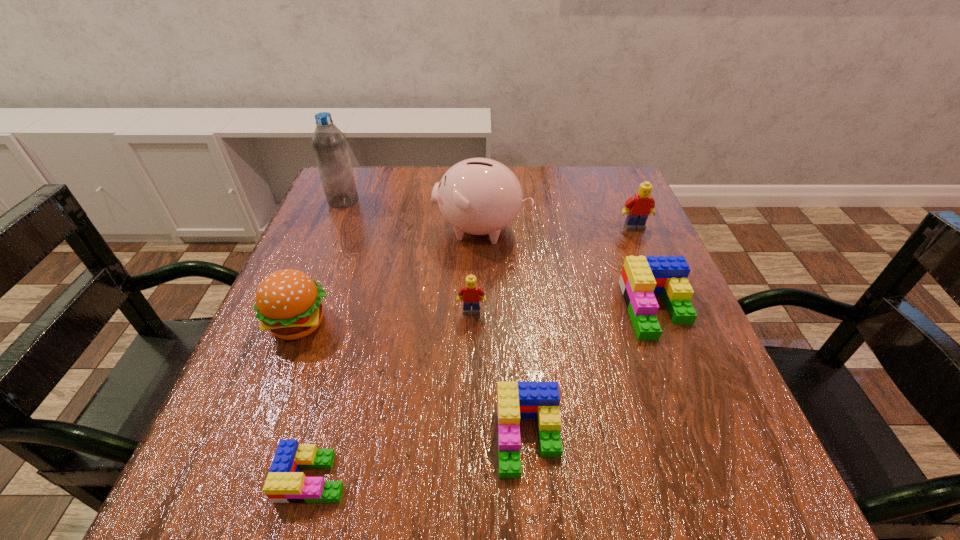
The width and height of the screenshot is (960, 540). I want to click on vacant area at the far edge of the desktop, so click(549, 176).

Image resolution: width=960 pixels, height=540 pixels. I want to click on blank space at the near edge, so click(x=548, y=502).

Find the location of a particular element. This screenshot has height=540, width=960. blank space at the left edge of the desktop is located at coordinates (311, 424).

At what (x,y) coordinates should I click in order to perform the action: click on vacant space at the right edge of the desktop. Please return your answer as a coordinate pair (x, y). The image size is (960, 540). Looking at the image, I should click on click(x=640, y=443).

The image size is (960, 540). In order to click on vacant space at the near left corner of the desktop in this screenshot , I will do `click(230, 465)`.

The height and width of the screenshot is (540, 960). In order to click on vacant space at the near right corner in this screenshot , I will do `click(666, 508)`.

Identify the location of free space that is in between the farthest green Lego and the hamburger. (478, 316).

This screenshot has height=540, width=960. Identify the location of empty space that is in between the bigger yellow Lego and the hamburger. (467, 275).

Find the location of a particular element. Image resolution: width=960 pixels, height=540 pixels. free space between the farthest Lego and the shortest object is located at coordinates (474, 352).

Image resolution: width=960 pixels, height=540 pixels. Find the location of `vacant space that is in between the hamburger and the pink piggy bank`. vacant space that is in between the hamburger and the pink piggy bank is located at coordinates (391, 276).